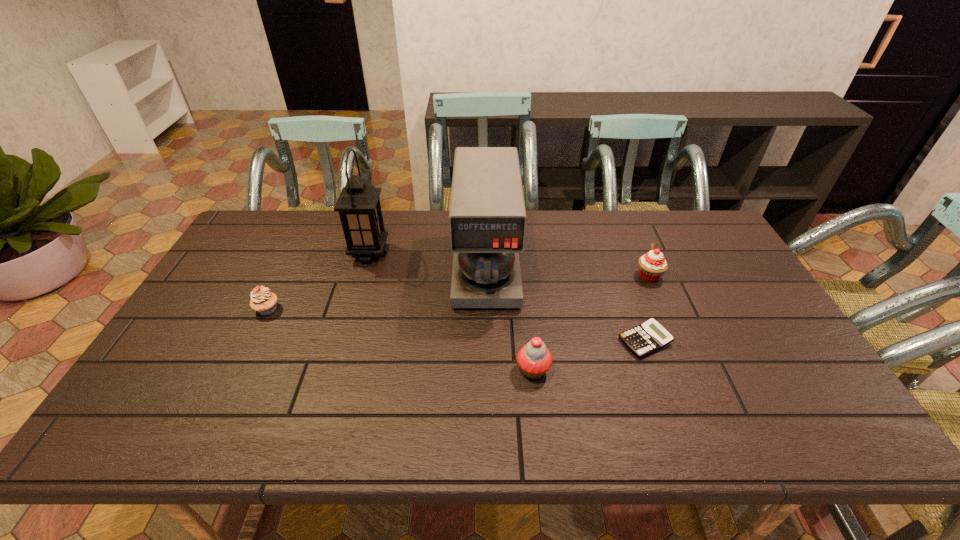
Identify which cupcake is located as the nearest to the calculator. Please provide its 2D coordinates. Your answer should be formatted as a tuple, i.e. [(x, y)], where the tuple contains the x and y coordinates of a point satisfying the conditions above.

[(652, 265)]

The image size is (960, 540). What are the coordinates of `the second closest cupcake to the rightmost cupcake` in the screenshot? It's located at (263, 301).

The image size is (960, 540). I want to click on vacant area that satisfies the following two spatial constraints: 1. on the back side of the nearest cupcake; 2. on the right side of the calculator, so click(530, 341).

Locate an element on the screen. Image resolution: width=960 pixels, height=540 pixels. free space that satisfies the following two spatial constraints: 1. on the front side of the second object from left to right; 2. on the right side of the rightmost cupcake is located at coordinates (363, 276).

At what (x,y) coordinates should I click in order to perform the action: click on free location that satisfies the following two spatial constraints: 1. on the carafe side of the coffee maker; 2. on the right side of the nearest cupcake. Please return your answer as a coordinate pair (x, y). This screenshot has width=960, height=540. Looking at the image, I should click on (488, 370).

The height and width of the screenshot is (540, 960). What are the coordinates of `vacant area in the image that satisfies the following two spatial constraints: 1. on the back side of the second cupcake from right to left; 2. on the left side of the shortest object` in the screenshot? It's located at (530, 341).

This screenshot has width=960, height=540. Identify the location of vacant space that satisfies the following two spatial constraints: 1. on the carafe side of the shortest object; 2. on the right side of the coffee maker. (487, 341).

Image resolution: width=960 pixels, height=540 pixels. I want to click on free region that satisfies the following two spatial constraints: 1. on the front side of the shortest cupcake; 2. on the left side of the nearest cupcake, so click(x=237, y=370).